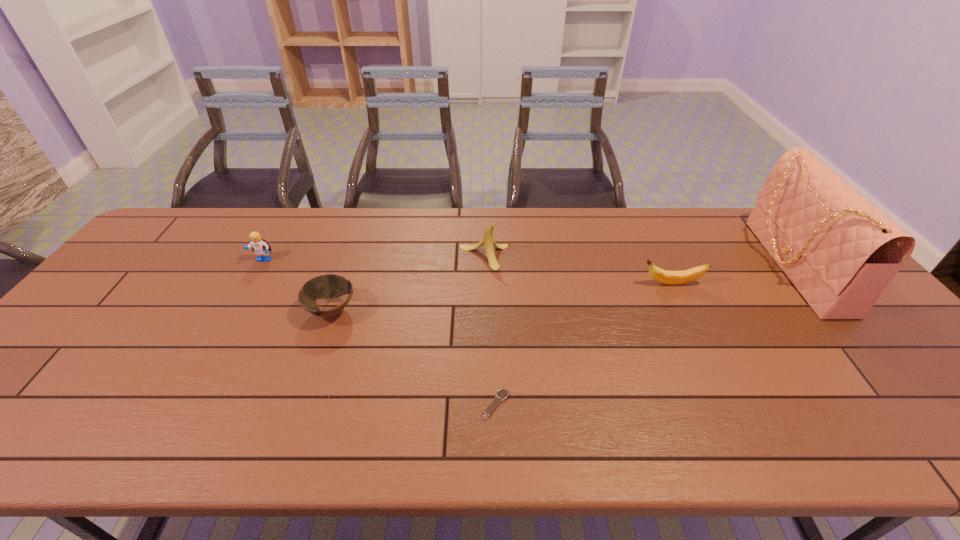
Locate an element on the screen. The height and width of the screenshot is (540, 960). unoccupied area between the tallest object and the shorter banana is located at coordinates (731, 275).

At what (x,y) coordinates should I click in order to perform the action: click on free point between the watch and the bowl. Please return your answer as a coordinate pair (x, y). Looking at the image, I should click on (x=413, y=357).

Where is `unoccupied position between the second object from right to left and the handbag`? unoccupied position between the second object from right to left and the handbag is located at coordinates (731, 275).

This screenshot has height=540, width=960. I want to click on empty space that is in between the left banana and the fifth object from right to left, so click(x=408, y=284).

The height and width of the screenshot is (540, 960). I want to click on free space that is in between the right banana and the taller banana, so click(x=579, y=270).

Find the location of `vacant space that is in between the left banana and the bowl`. vacant space that is in between the left banana and the bowl is located at coordinates (408, 284).

Locate an element on the screen. The height and width of the screenshot is (540, 960). free space between the left banana and the rightmost object is located at coordinates (637, 261).

This screenshot has width=960, height=540. Find the location of `free space between the shortest object and the Lego`. free space between the shortest object and the Lego is located at coordinates (379, 333).

I want to click on vacant area that lies between the left banana and the nearest object, so click(x=490, y=330).

Point out which object is positioned as the fourth nearest to the left banana. Please provide its 2D coordinates. Your answer should be formatted as a tuple, i.e. [(x, y)], where the tuple contains the x and y coordinates of a point satisfying the conditions above.

[(260, 247)]